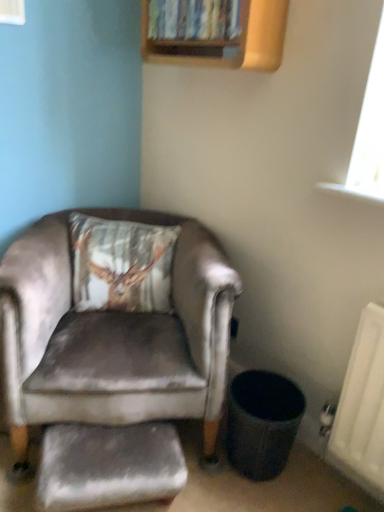
Question: Are satin grey armchair at left and velvet-like brown pillow at upper left far apart?

Choices:
 (A) yes
 (B) no

Answer: (B)

Question: Is velvet-like brown pillow at upper left completely or partially inside satin grey armchair at left?

Choices:
 (A) no
 (B) yes

Answer: (B)

Question: Is satin grey armchair at left to the right of velvet-like brown pillow at upper left from the viewer's perspective?

Choices:
 (A) yes
 (B) no

Answer: (B)

Question: Considering the relative positions of satin grey armchair at left and velvet-like brown pillow at upper left in the image provided, is satin grey armchair at left to the left of velvet-like brown pillow at upper left from the viewer's perspective?

Choices:
 (A) no
 (B) yes

Answer: (B)

Question: From a real-world perspective, is satin grey armchair at left physically above velvet-like brown pillow at upper left?

Choices:
 (A) yes
 (B) no

Answer: (B)

Question: Is wooden bookshelf at upper center in front of or behind velvet-like brown pillow at upper left in the image?

Choices:
 (A) behind
 (B) front

Answer: (B)

Question: Is wooden bookshelf at upper center wider or thinner than velvet-like brown pillow at upper left?

Choices:
 (A) wide
 (B) thin

Answer: (B)

Question: Is point (158, 5) closer or farther from the camera than point (170, 282)?

Choices:
 (A) farther
 (B) closer

Answer: (B)

Question: Is wooden bookshelf at upper center taller or shorter than velvet-like brown pillow at upper left?

Choices:
 (A) tall
 (B) short

Answer: (B)

Question: Considering the positions of point (71, 503) and point (208, 298), is point (71, 503) closer or farther from the camera than point (208, 298)?

Choices:
 (A) closer
 (B) farther

Answer: (A)

Question: Based on their sizes in the image, would you say velvet grey footrest at lower left is bigger or smaller than satin grey armchair at left?

Choices:
 (A) small
 (B) big

Answer: (A)

Question: From their relative heights in the image, would you say velvet grey footrest at lower left is taller or shorter than satin grey armchair at left?

Choices:
 (A) short
 (B) tall

Answer: (A)

Question: From the image's perspective, relative to satin grey armchair at left, is velvet grey footrest at lower left above or below?

Choices:
 (A) above
 (B) below

Answer: (B)

Question: Would you say satin grey armchair at left is to the left or to the right of velvet grey footrest at lower left in the picture?

Choices:
 (A) right
 (B) left

Answer: (B)

Question: From a real-world perspective, is satin grey armchair at left positioned above or below velvet grey footrest at lower left?

Choices:
 (A) above
 (B) below

Answer: (A)